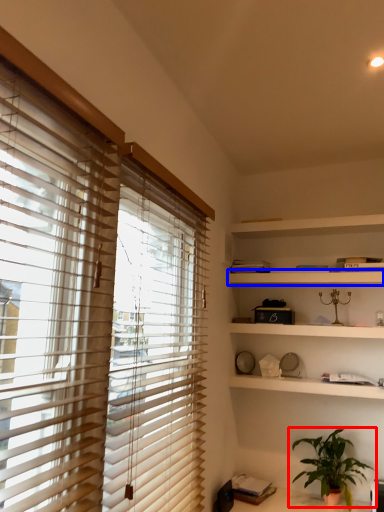
Question: Among these objects, which one is farthest to the camera, houseplant (highlighted by a red box) or shelf (highlighted by a blue box)?

Choices:
 (A) houseplant
 (B) shelf

Answer: (B)